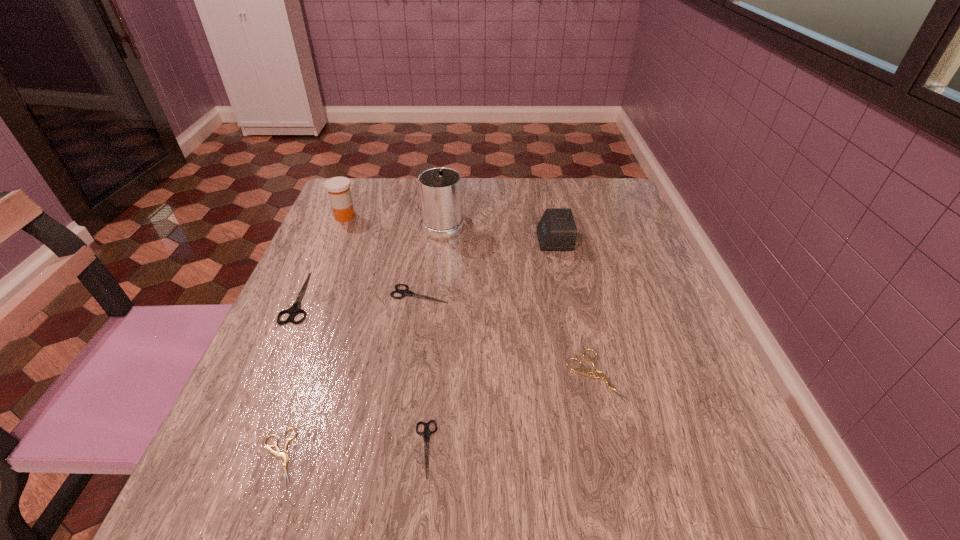
The width and height of the screenshot is (960, 540). I want to click on vacant space situated 0.310m on the back of the tallest shears, so click(x=345, y=199).

In order to click on free spot located on the front of the fourth shortest object in this screenshot , I will do `click(411, 354)`.

Find the location of a particular element. The width and height of the screenshot is (960, 540). free space located on the front of the sixth farthest object is located at coordinates (612, 444).

The image size is (960, 540). I want to click on vacant space located on the back of the nearest black shears, so click(x=439, y=312).

The image size is (960, 540). I want to click on free space located on the right of the smaller beige shears, so click(x=367, y=456).

Where is `mug that is at the far edge`? This screenshot has width=960, height=540. mug that is at the far edge is located at coordinates (440, 188).

Locate an element on the screen. medicine present at the far edge is located at coordinates pos(338,188).

You are a GUI agent. You are given a task and a screenshot of the screen. Output one action in this format:
    pyautogui.click(x=<x>, y=<y>)
    Task: Click on the medicine located at the left edge
    
    Given the screenshot: What is the action you would take?
    pyautogui.click(x=338, y=188)

Where is `object at the right edge`? object at the right edge is located at coordinates (589, 373).

Find the location of `object that is positioned at the far left corner`. object that is positioned at the far left corner is located at coordinates (338, 188).